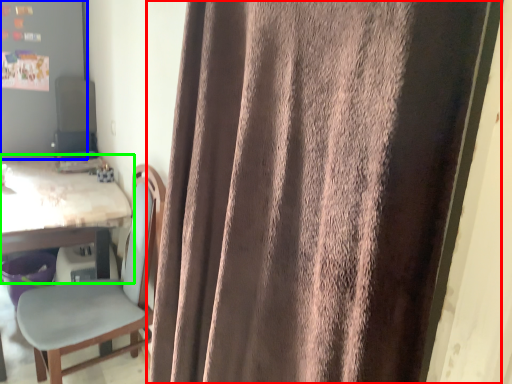
Question: Estimate the real-world distances between objects in this image. Which object is closer to curtain (highlighted by a red box), bulletin board (highlighted by a blue box) or table (highlighted by a green box)?

Choices:
 (A) bulletin board
 (B) table

Answer: (B)